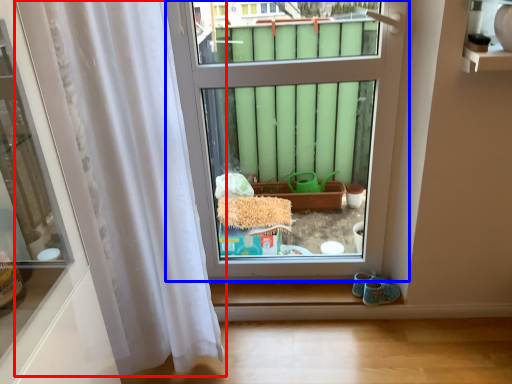
Question: Which point is closer to the camera, curtain (highlighted by a red box) or window (highlighted by a blue box)?

Choices:
 (A) curtain
 (B) window

Answer: (A)